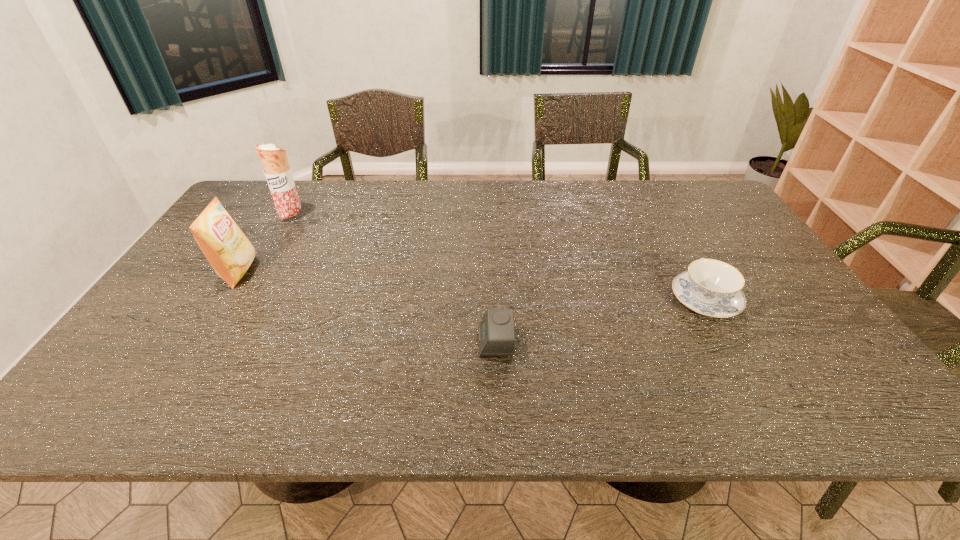
The width and height of the screenshot is (960, 540). In order to click on the tallest object in this screenshot , I will do click(277, 171).

Find the location of `the farthest object`. the farthest object is located at coordinates (277, 171).

At what (x,y) coordinates should I click in order to perform the action: click on the third shortest object. Please return your answer as a coordinate pair (x, y). Looking at the image, I should click on (230, 253).

Locate an element on the screen. The image size is (960, 540). the third tallest object is located at coordinates (710, 287).

Identify the location of the rightmost object. This screenshot has height=540, width=960. (710, 287).

What are the coordinates of `alarm clock` in the screenshot? It's located at (496, 330).

I want to click on the second object from right to left, so click(496, 330).

Where is `free space located on the right of the burrito`? Image resolution: width=960 pixels, height=540 pixels. free space located on the right of the burrito is located at coordinates (359, 216).

Image resolution: width=960 pixels, height=540 pixels. I want to click on free location located on the front-facing side of the crisp (potato chip), so click(286, 272).

Locate an element on the screen. This screenshot has height=540, width=960. vacant space positioned 0.200m with the handle on the side of the rightmost object is located at coordinates (669, 234).